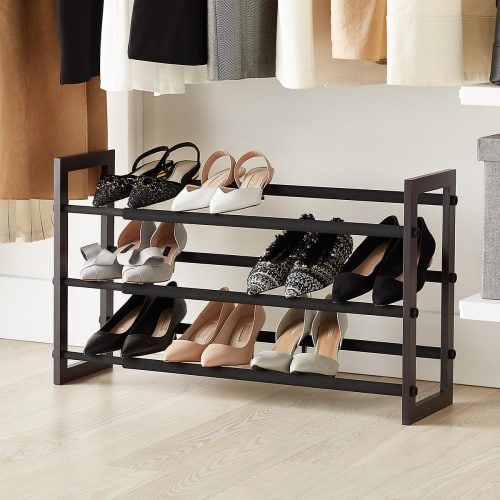
Locate an element on the screen. shoes on top shelf is located at coordinates (250, 205), (198, 193), (154, 195), (116, 193).